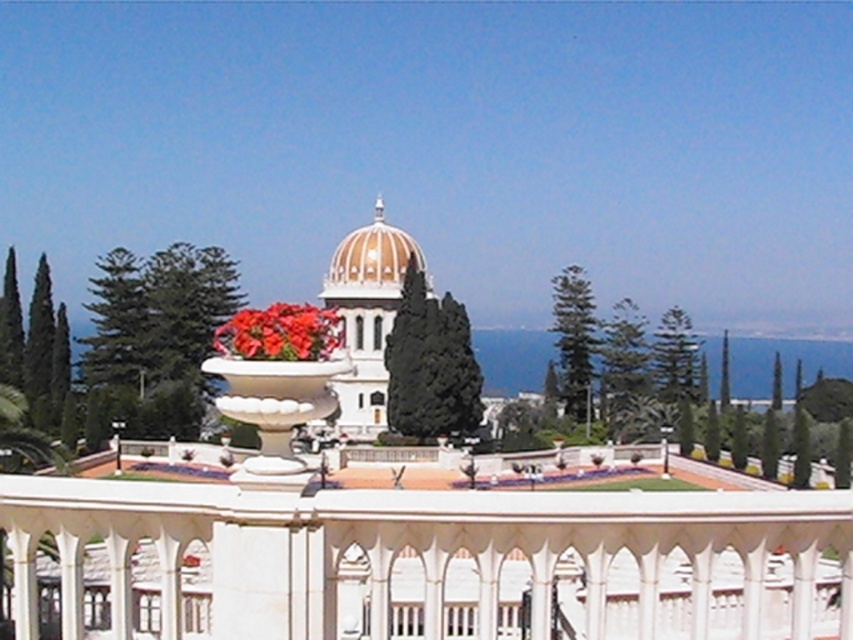
You are a landscape architect planning to place a new statue in the garden. The statue requires a spot where it can be seen clearly from the entrance path. Given the white glossy vase at center and the dark green textured cypress tree at center, which object is shorter and would allow the statue to be visible without obstruction?

The white glossy vase at center has a lesser height compared to the dark green textured cypress tree at center, so placing the statue near the white glossy vase at center would ensure better visibility without obstruction from the taller cypress tree.

You are standing in front of the white building with a golden dome. You want to place a decorative item exactly at the center of the scene. Is the white glossy vase at center already positioned there?

Yes, the white glossy vase at center is already positioned at the center of the scene since it is located at point (277, 381), which is the center coordinate.

You are an interior designer arranging a floral display. You have a white glossy vase at center and glossy ceramic flowers at center. Which object should you move to the right to align them properly?

The white glossy vase at center is positioned on the left side of glossy ceramic flowers at center, so you should move the white glossy vase at center to the right to align them properly.